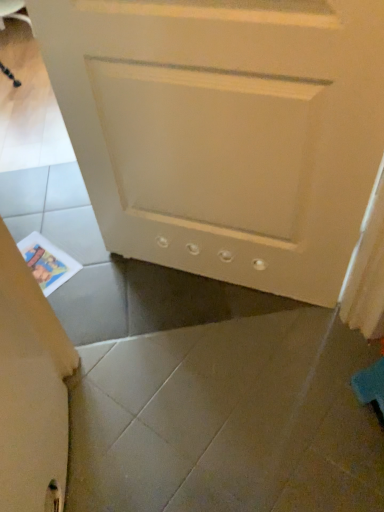
Where is `free space above printed paper at lower left (from a real-world perspective)`? Image resolution: width=384 pixels, height=512 pixels. free space above printed paper at lower left (from a real-world perspective) is located at coordinates (44, 263).